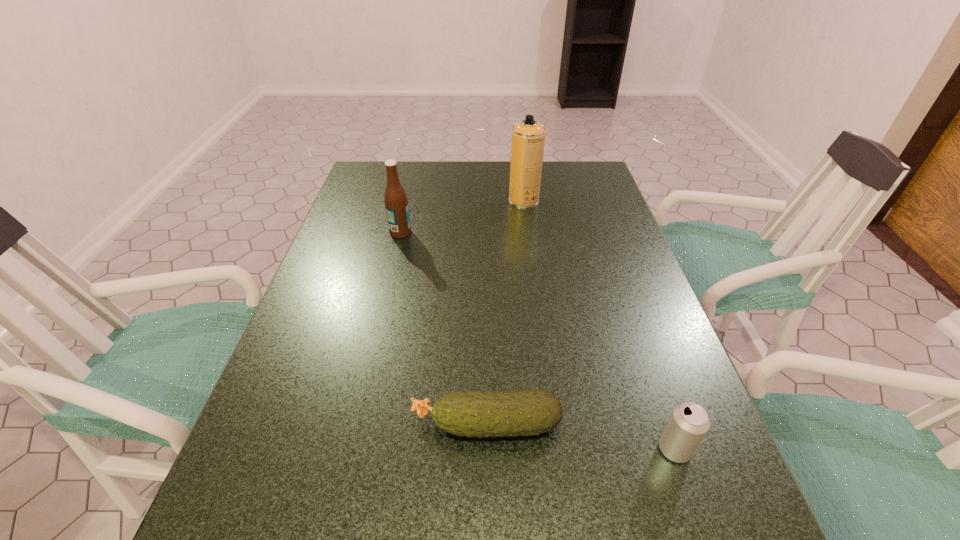
Where is `free space located 0.270m at the blossom end of the cucumber`? The height and width of the screenshot is (540, 960). free space located 0.270m at the blossom end of the cucumber is located at coordinates [x=264, y=424].

At what (x,y) coordinates should I click in order to perform the action: click on free region located at the blossom end of the cucumber. Please return your answer as a coordinate pair (x, y). The height and width of the screenshot is (540, 960). Looking at the image, I should click on (302, 424).

Find the location of a particular element. Image resolution: width=960 pixels, height=540 pixels. free space located 0.130m at the blossom end of the cucumber is located at coordinates (341, 424).

Identify the location of object that is at the far edge. The width and height of the screenshot is (960, 540). pyautogui.click(x=528, y=136).

Where is `object present at the left edge`? Image resolution: width=960 pixels, height=540 pixels. object present at the left edge is located at coordinates (396, 204).

This screenshot has height=540, width=960. I want to click on object at the right edge, so click(688, 424).

Image resolution: width=960 pixels, height=540 pixels. Identify the location of vacant space at the far edge. pos(460,177).

The height and width of the screenshot is (540, 960). In order to click on free region at the left edge of the desktop in this screenshot , I will do `click(384, 220)`.

At what (x,y) coordinates should I click in order to perform the action: click on free space at the right edge of the desktop. Please return your answer as a coordinate pair (x, y). The width and height of the screenshot is (960, 540). Looking at the image, I should click on (588, 271).

Identify the location of free space at the far left corner. This screenshot has height=540, width=960. (368, 182).